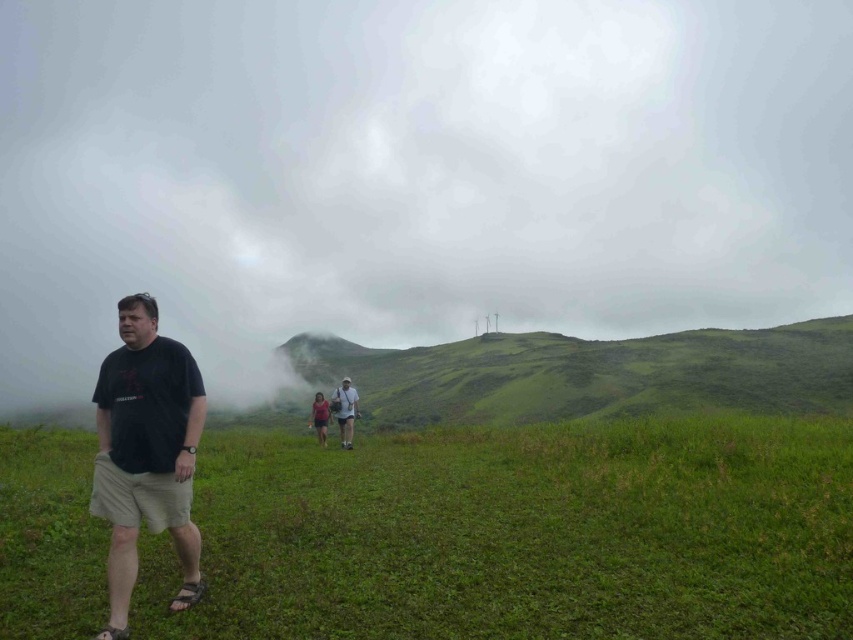
You are standing in the grassy field and see the white fluffy cloud at upper center and the light brown shorts at center. Which object is located to the right of the other?

The white fluffy cloud at upper center is positioned on the right side of light brown shorts at center.

Based on the photo, you are standing in the field and want to walk to the green grassy hillside at center without stepping on the black cotton shirt at left. Is the path wide enough for you to walk around it?

The green grassy hillside at center is wider than the black cotton shirt at left, so yes, you can walk around the black cotton shirt at left to reach the green grassy hillside at center without stepping on it.

Looking at this image, you are standing in the grassy field and looking towards the distant hill. Which object is closer to you, the white fluffy cloud at upper center or the light brown shorts at center?

The white fluffy cloud at upper center is closer to you because it is in front of the light brown shorts at center.